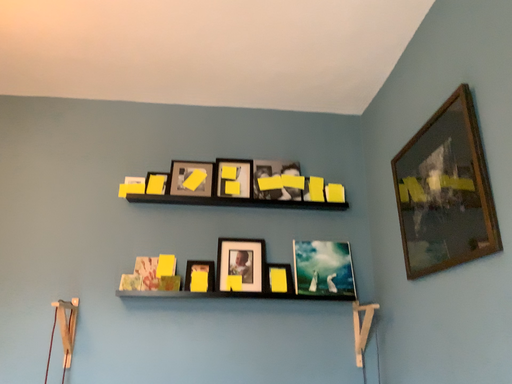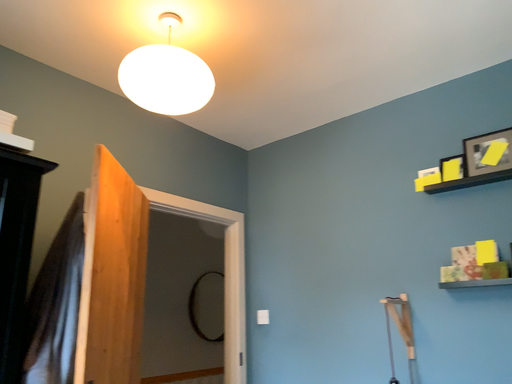
Question: Which way did the camera rotate in the video?

Choices:
 (A) rotated downward
 (B) rotated upward

Answer: (A)